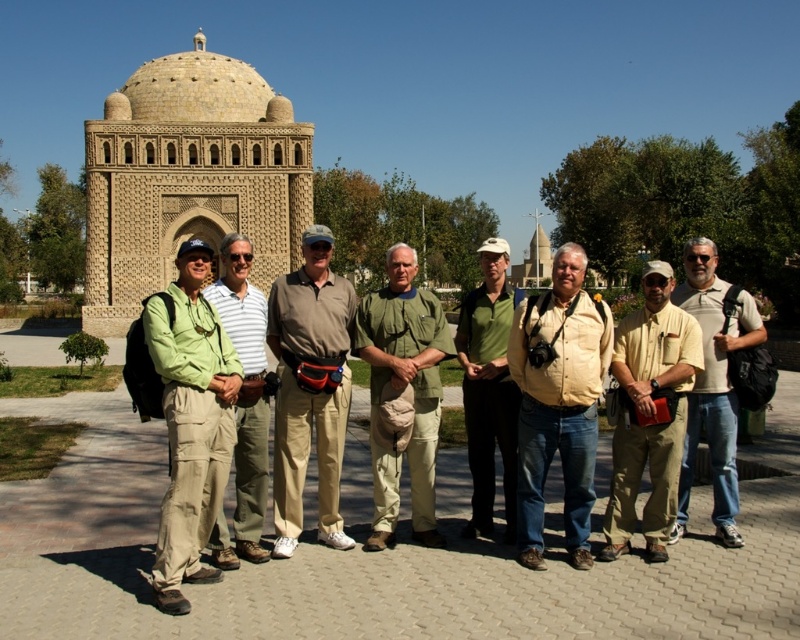
Question: Is tan/cotton cargo pants at center further to camera compared to tan fabric shirt at center?

Choices:
 (A) no
 (B) yes

Answer: (A)

Question: Among these objects, which one is nearest to the camera?

Choices:
 (A) green canvas shirt at center
 (B) tan/cotton cargo pants at center
 (C) green canvas pants at center
 (D) green matte shirt at center

Answer: (C)

Question: Which of these objects is positioned farthest from the green canvas pants at center?

Choices:
 (A) green canvas shirt at center
 (B) light brown denim jeans at center
 (C) tan/cotton cargo pants at center
 (D) tan fabric shirt at center

Answer: (B)

Question: In this image, where is tan/cotton cargo pants at center located relative to tan fabric shirt at center?

Choices:
 (A) right
 (B) left

Answer: (B)

Question: Can you confirm if tan/cotton cargo pants at center is positioned below green matte shirt at center?

Choices:
 (A) no
 (B) yes

Answer: (A)

Question: Estimate the real-world distances between objects in this image. Which object is closer to the green matte shirt at center?

Choices:
 (A) tan fabric shirt at center
 (B) yellow matte shirt at center
 (C) green canvas shirt at center

Answer: (B)